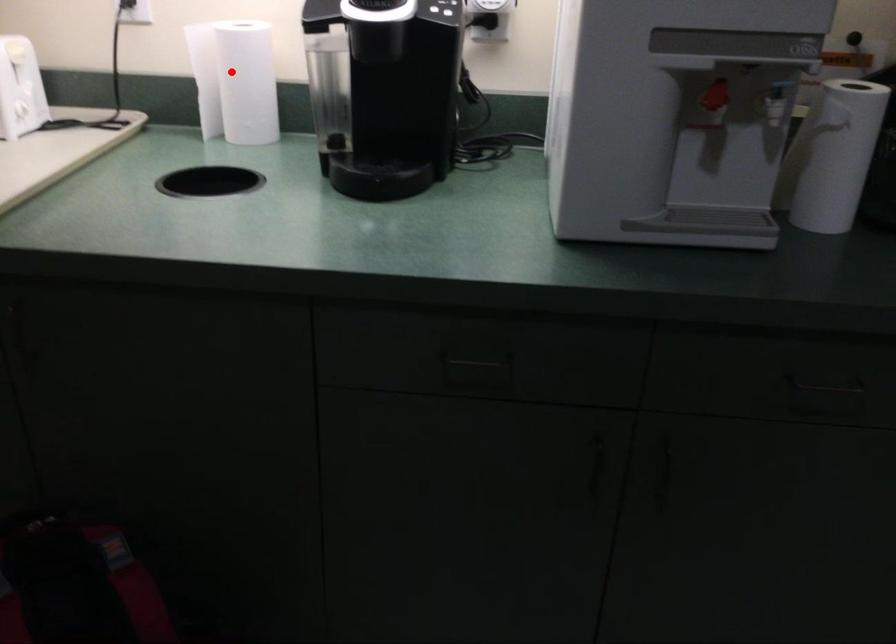
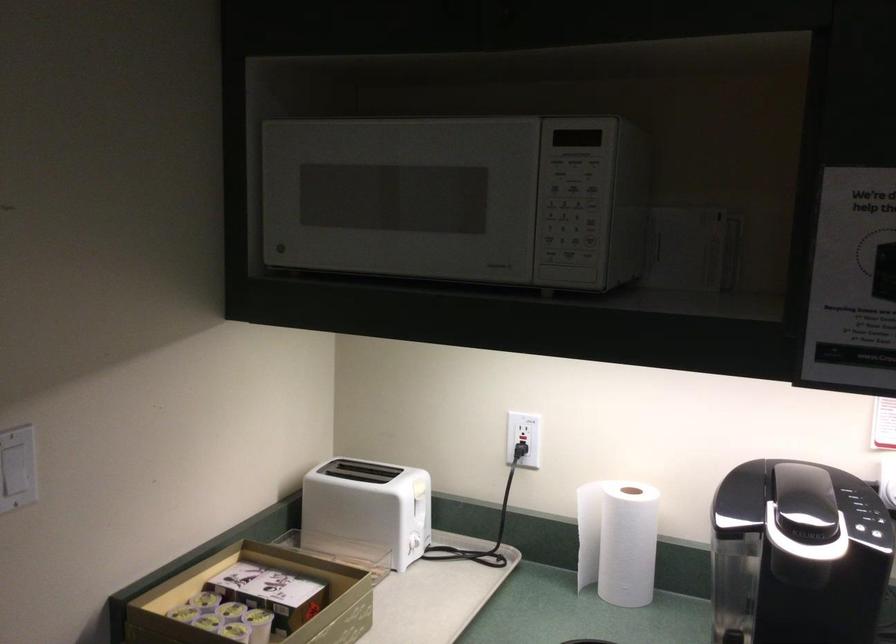
Where in the second image is the point corresponding to the highlighted location from the first image?

(617, 540)